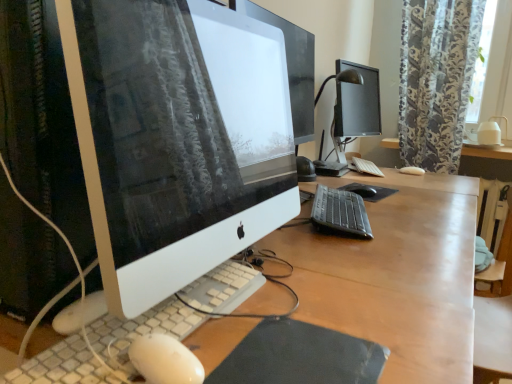
Image resolution: width=512 pixels, height=384 pixels. What do you see at coordinates (143, 327) in the screenshot? I see `white textured keyboard at center, the 3th computer keyboard from the right` at bounding box center [143, 327].

Find the location of a particular element. This screenshot has width=512, height=384. black matte mousepad at lower center, arranged as the first mousepad when ordered from the bottom is located at coordinates (300, 357).

What do you see at coordinates (340, 212) in the screenshot? I see `black plastic keyboard at center, the second computer keyboard from the front` at bounding box center [340, 212].

You are a GUI agent. You are given a task and a screenshot of the screen. Output one action in this format:
    pyautogui.click(x=<x>, y=<y>)
    Task: Click on the white glossy computer monitor at center
    The image size is (512, 384).
    Given the screenshot: What is the action you would take?
    pyautogui.click(x=177, y=138)

From the image's perspective, relative to floral-patterned fabric at upper right, is white matte keyboard at center, the third computer keyboard when ordered from front to back, above or below?

Clearly, from the image's perspective, white matte keyboard at center, the third computer keyboard when ordered from front to back, is below floral-patterned fabric at upper right.

Which object is positioned more to the left, white matte keyboard at center, the third computer keyboard from the left, or floral-patterned fabric at upper right?

white matte keyboard at center, the third computer keyboard from the left.

Is white matte keyboard at center, the 1th computer keyboard viewed from the back, taller or shorter than floral-patterned fabric at upper right?

Clearly, white matte keyboard at center, the 1th computer keyboard viewed from the back, is shorter compared to floral-patterned fabric at upper right.

Is black rubber mousepad at center, which is counted as the 2th mousepad, starting from the front, taller or shorter than white textured keyboard at center, the first computer keyboard from the left?

Clearly, black rubber mousepad at center, which is counted as the 2th mousepad, starting from the front, is shorter compared to white textured keyboard at center, the first computer keyboard from the left.

Could you measure the distance between black rubber mousepad at center, the second mousepad positioned from the bottom, and white textured keyboard at center, arranged as the first computer keyboard when ordered from the bottom?

36.91 inches.

Which is nearer, (355, 187) or (175, 330)?

Point (355, 187) is farther from the camera than point (175, 330).

From the image's perspective, is black rubber mousepad at center, the first mousepad from the top, beneath white textured keyboard at center, arranged as the first computer keyboard when ordered from the bottom?

No, from the image's perspective, black rubber mousepad at center, the first mousepad from the top, is not beneath white textured keyboard at center, arranged as the first computer keyboard when ordered from the bottom.

Could you tell me if wooden desk at center, marked as the second desk in a right-to-left arrangement, is facing floral-patterned fabric at upper right?

No.

Who is taller, wooden desk at center, the 2th desk viewed from the top, or floral-patterned fabric at upper right?

wooden desk at center, the 2th desk viewed from the top, is taller.

Based on the photo, how distant is wooden desk at center, acting as the 1th desk starting from the front, from floral-patterned fabric at upper right?

wooden desk at center, acting as the 1th desk starting from the front, and floral-patterned fabric at upper right are 38.86 inches apart from each other.

Which object is more forward, wooden desk at center, placed as the 1th desk when sorted from left to right, or floral-patterned fabric at upper right?

Positioned in front is wooden desk at center, placed as the 1th desk when sorted from left to right.

Between point (329, 212) and point (237, 237), which one is positioned in front?

The point (237, 237) is closer.

Is black plastic keyboard at center, the second computer keyboard from the front, facing away from white glossy computer monitor at center?

black plastic keyboard at center, the second computer keyboard from the front, is not turned away from white glossy computer monitor at center.

Considering the sizes of objects black plastic keyboard at center, the second computer keyboard from the front, and white glossy computer monitor at center in the image provided, who is smaller, black plastic keyboard at center, the second computer keyboard from the front, or white glossy computer monitor at center?

With smaller size is black plastic keyboard at center, the second computer keyboard from the front.

Considering the relative sizes of black plastic keyboard at center, acting as the second computer keyboard starting from the left, and white glossy computer monitor at center in the image provided, is black plastic keyboard at center, acting as the second computer keyboard starting from the left, thinner than white glossy computer monitor at center?

In fact, black plastic keyboard at center, acting as the second computer keyboard starting from the left, might be wider than white glossy computer monitor at center.

From a real-world perspective, is wooden desk at center, acting as the 1th desk starting from the front, over white matte keyboard at center, marked as the first computer keyboard in a top-to-bottom arrangement?

No, from a real-world perspective, wooden desk at center, acting as the 1th desk starting from the front, is not on top of white matte keyboard at center, marked as the first computer keyboard in a top-to-bottom arrangement.

Image resolution: width=512 pixels, height=384 pixels. Identify the location of desk below the white matte keyboard at center, marked as the first computer keyboard in a top-to-bottom arrangement (from the image's perspective). (395, 275).

Is wooden desk at center, placed as the first desk when sorted from bottom to top, directly adjacent to white matte keyboard at center, marked as the first computer keyboard in a top-to-bottom arrangement?

No, wooden desk at center, placed as the first desk when sorted from bottom to top, is not next to white matte keyboard at center, marked as the first computer keyboard in a top-to-bottom arrangement.

Considering the sizes of objects wooden desk at center, positioned as the first desk in top-to-bottom order, and black glossy monitor at upper right in the image provided, who is smaller, wooden desk at center, positioned as the first desk in top-to-bottom order, or black glossy monitor at upper right?

With smaller size is wooden desk at center, positioned as the first desk in top-to-bottom order.

Which is more to the right, wooden desk at center, positioned as the first desk in back-to-front order, or black glossy monitor at upper right?

wooden desk at center, positioned as the first desk in back-to-front order, is more to the right.

Between wooden desk at center, positioned as the first desk in top-to-bottom order, and black glossy monitor at upper right, which one has smaller width?

black glossy monitor at upper right is thinner.

This screenshot has width=512, height=384. In order to click on desktop computer that appears in front of the wooden desk at center, positioned as the second desk in left-to-right order in this screenshot , I will do `click(351, 111)`.

From the image's perspective, between floral-patterned fabric at upper right and wooden desk at center, acting as the 1th desk starting from the front, which one is located above?

floral-patterned fabric at upper right.

From a real-world perspective, is floral-patterned fabric at upper right beneath wooden desk at center, placed as the first desk when sorted from bottom to top?

No, from a real-world perspective, floral-patterned fabric at upper right is not below wooden desk at center, placed as the first desk when sorted from bottom to top.

Does floral-patterned fabric at upper right turn towards wooden desk at center, placed as the first desk when sorted from bottom to top?

Yes, floral-patterned fabric at upper right is oriented towards wooden desk at center, placed as the first desk when sorted from bottom to top.

The width and height of the screenshot is (512, 384). What are the coordinates of `curtain lying on the right of white matte keyboard at center, the third computer keyboard when ordered from front to back` in the screenshot? It's located at (436, 79).

Find the location of a particular element. mousepad located behind the white textured keyboard at center, the first computer keyboard from the left is located at coordinates (369, 191).

Which object lies further to the anchor point black matte mouse at center, white textured keyboard at center, acting as the first computer keyboard starting from the front, or wooden desk at center, acting as the second desk starting from the bottom?

wooden desk at center, acting as the second desk starting from the bottom, is positioned further to the anchor black matte mouse at center.

Estimate the real-world distances between objects in this image. Which object is closer to white matte keyboard at center, which appears as the first computer keyboard when viewed from the right, black matte mouse at center or black rubber mousepad at center, the second mousepad when ordered from left to right?

black rubber mousepad at center, the second mousepad when ordered from left to right.

When comparing their distances from wooden desk at center, positioned as the first desk in back-to-front order, does black plastic keyboard at center, the second computer keyboard from the front, or black matte mouse at center seem further?

black plastic keyboard at center, the second computer keyboard from the front, is further to wooden desk at center, positioned as the first desk in back-to-front order.

Based on their spatial positions, is white glossy computer monitor at center or white textured keyboard at center, the first computer keyboard from the left, further from white matte keyboard at center, placed as the third computer keyboard when sorted from bottom to top?

white textured keyboard at center, the first computer keyboard from the left, is positioned further to the anchor white matte keyboard at center, placed as the third computer keyboard when sorted from bottom to top.

Which object lies further to the anchor point wooden desk at center, the 2th desk viewed from the top, white textured keyboard at center, the first computer keyboard from the left, or black matte mousepad at lower center, positioned as the second mousepad in right-to-left order?

The object further to wooden desk at center, the 2th desk viewed from the top, is black matte mousepad at lower center, positioned as the second mousepad in right-to-left order.

Looking at this image, estimate the real-world distances between objects in this image. Which object is closer to black matte mouse at center, wooden desk at center, the 2th desk viewed from the top, or black plastic keyboard at center, positioned as the 2th computer keyboard in right-to-left order?

black plastic keyboard at center, positioned as the 2th computer keyboard in right-to-left order, lies closer to black matte mouse at center than the other object.

In the scene shown: When comparing their distances from black matte mouse at center, does wooden desk at center, acting as the second desk starting from the bottom, or black plastic keyboard at center, the second computer keyboard from the front, seem further?

Based on the image, wooden desk at center, acting as the second desk starting from the bottom, appears to be further to black matte mouse at center.

Considering their positions, is black matte mousepad at lower center, positioned as the second mousepad in right-to-left order, positioned closer to white textured keyboard at center, acting as the first computer keyboard starting from the front, than floral-patterned fabric at upper right?

Based on the image, black matte mousepad at lower center, positioned as the second mousepad in right-to-left order, appears to be nearer to white textured keyboard at center, acting as the first computer keyboard starting from the front.

Where is `desktop computer positioned between white textured keyboard at center, the 3th computer keyboard from the right, and wooden desk at center, positioned as the second desk in left-to-right order, from near to far`? The width and height of the screenshot is (512, 384). desktop computer positioned between white textured keyboard at center, the 3th computer keyboard from the right, and wooden desk at center, positioned as the second desk in left-to-right order, from near to far is located at coordinates (351, 111).

Where is `mousepad between black matte mousepad at lower center, the 1th mousepad in the front-to-back sequence, and floral-patterned fabric at upper right from front to back`? Image resolution: width=512 pixels, height=384 pixels. mousepad between black matte mousepad at lower center, the 1th mousepad in the front-to-back sequence, and floral-patterned fabric at upper right from front to back is located at coordinates (369, 191).

Where is `mouse positioned between white glossy computer monitor at center and wooden desk at center, acting as the second desk starting from the bottom, from near to far`? The image size is (512, 384). mouse positioned between white glossy computer monitor at center and wooden desk at center, acting as the second desk starting from the bottom, from near to far is located at coordinates (361, 190).

The width and height of the screenshot is (512, 384). What are the coordinates of `computer monitor between wooden desk at center, placed as the first desk when sorted from bottom to top, and black rubber mousepad at center, the second mousepad positioned from the bottom, from front to back` in the screenshot? It's located at (177, 138).